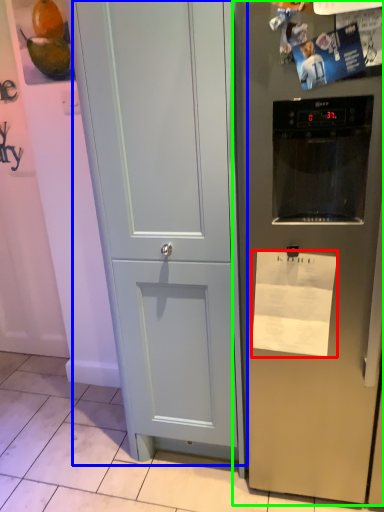
Question: Which is nearer to the paper (highlighted by a red box)? door (highlighted by a blue box) or refrigerator (highlighted by a green box).

Choices:
 (A) door
 (B) refrigerator

Answer: (B)